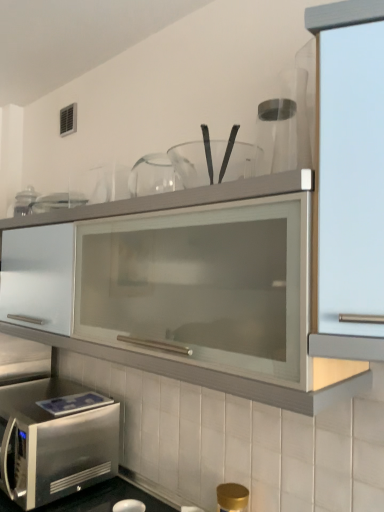
Find the location of a particular element. The height and width of the screenshot is (512, 384). stainless steel microwave at lower left is located at coordinates coord(55,440).

Identify the location of satin glass cabinet at right. The width and height of the screenshot is (384, 512). (348, 184).

Where is `transparent glass jar at upper center`? The height and width of the screenshot is (512, 384). transparent glass jar at upper center is located at coordinates (197, 162).

Consider the image. Considering the relative positions of transparent glass jar at upper center and satin glass cabinet at right in the image provided, is transparent glass jar at upper center to the right of satin glass cabinet at right from the viewer's perspective?

In fact, transparent glass jar at upper center is to the left of satin glass cabinet at right.

Can you tell me how much transparent glass jar at upper center and satin glass cabinet at right differ in facing direction?

The angular difference between transparent glass jar at upper center and satin glass cabinet at right is 0.795 degrees.

Where is `tableware that appears above the satin glass cabinet at right (from a real-world perspective)`? This screenshot has height=512, width=384. tableware that appears above the satin glass cabinet at right (from a real-world perspective) is located at coordinates (197, 162).

Does transparent glass jar at upper center appear on the left side of stainless steel microwave at lower left?

Incorrect, transparent glass jar at upper center is not on the left side of stainless steel microwave at lower left.

Image resolution: width=384 pixels, height=512 pixels. I want to click on microwave oven on the left of transparent glass jar at upper center, so click(x=55, y=440).

From a real-world perspective, is satin glass cabinet at right positioned over stainless steel microwave at lower left based on gravity?

Yes, from a real-world perspective, satin glass cabinet at right is above stainless steel microwave at lower left.

How many degrees apart are the facing directions of satin glass cabinet at right and stainless steel microwave at lower left?

0.573 degrees separate the facing orientations of satin glass cabinet at right and stainless steel microwave at lower left.

Would you say stainless steel microwave at lower left is part of satin glass cabinet at right's contents?

No, stainless steel microwave at lower left is not inside satin glass cabinet at right.

From the image's perspective, between satin glass cabinet at right and stainless steel microwave at lower left, which one is located above?

satin glass cabinet at right is shown above in the image.

Would you consider satin glass cabinet at right to be distant from transparent glass jar at upper center?

They are positioned close to each other.

Considering the relative sizes of satin glass cabinet at right and transparent glass jar at upper center in the image provided, is satin glass cabinet at right thinner than transparent glass jar at upper center?

In fact, satin glass cabinet at right might be wider than transparent glass jar at upper center.

Considering the positions of objects satin glass cabinet at right and transparent glass jar at upper center in the image provided, who is more to the right, satin glass cabinet at right or transparent glass jar at upper center?

satin glass cabinet at right.

From a real-world perspective, is satin glass cabinet at right beneath transparent glass jar at upper center?

Yes.

From the image's perspective, is stainless steel microwave at lower left positioned above or below satin glass cabinet at right?

Clearly, from the image's perspective, stainless steel microwave at lower left is below satin glass cabinet at right.

Is stainless steel microwave at lower left inside the boundaries of satin glass cabinet at right, or outside?

stainless steel microwave at lower left is outside satin glass cabinet at right.

Is stainless steel microwave at lower left oriented away from satin glass cabinet at right?

No, stainless steel microwave at lower left is not facing the opposite direction of satin glass cabinet at right.

Looking at this image, how different are the orientations of stainless steel microwave at lower left and satin glass cabinet at right in degrees?

0.573 degrees.

Where is `tableware above the stainless steel microwave at lower left (from a real-world perspective)`? This screenshot has width=384, height=512. tableware above the stainless steel microwave at lower left (from a real-world perspective) is located at coordinates (197, 162).

Does stainless steel microwave at lower left have a lesser width compared to transparent glass jar at upper center?

No, stainless steel microwave at lower left is not thinner than transparent glass jar at upper center.

Does stainless steel microwave at lower left lie behind transparent glass jar at upper center?

Yes, stainless steel microwave at lower left is behind transparent glass jar at upper center.

How much distance is there between stainless steel microwave at lower left and transparent glass jar at upper center?

stainless steel microwave at lower left is 1.02 meters from transparent glass jar at upper center.

Where is `tableware lying behind the satin glass cabinet at right`? tableware lying behind the satin glass cabinet at right is located at coordinates (197, 162).

Identify the location of tableware positioned vertically above the stainless steel microwave at lower left (from a real-world perspective). (197, 162).

Looking at the image, which one is located further to transparent glass jar at upper center, satin glass cabinet at right or stainless steel microwave at lower left?

The object further to transparent glass jar at upper center is stainless steel microwave at lower left.

From the picture: Based on their spatial positions, is transparent glass jar at upper center or stainless steel microwave at lower left closer to satin glass cabinet at right?

transparent glass jar at upper center is positioned closer to the anchor satin glass cabinet at right.

Estimate the real-world distances between objects in this image. Which object is further from satin glass cabinet at right, stainless steel microwave at lower left or transparent glass jar at upper center?

The object further to satin glass cabinet at right is stainless steel microwave at lower left.

Which object lies nearer to the anchor point transparent glass jar at upper center, stainless steel microwave at lower left or satin glass cabinet at right?

satin glass cabinet at right is closer to transparent glass jar at upper center.

When comparing their distances from stainless steel microwave at lower left, does transparent glass jar at upper center or satin glass cabinet at right seem closer?

transparent glass jar at upper center is closer to stainless steel microwave at lower left.

Looking at the image, which one is located closer to stainless steel microwave at lower left, satin glass cabinet at right or transparent glass jar at upper center?

transparent glass jar at upper center.

Find the location of `cabinetry that lies between transparent glass jar at upper center and stainless steel microwave at lower left from top to bottom`. cabinetry that lies between transparent glass jar at upper center and stainless steel microwave at lower left from top to bottom is located at coordinates (348, 184).